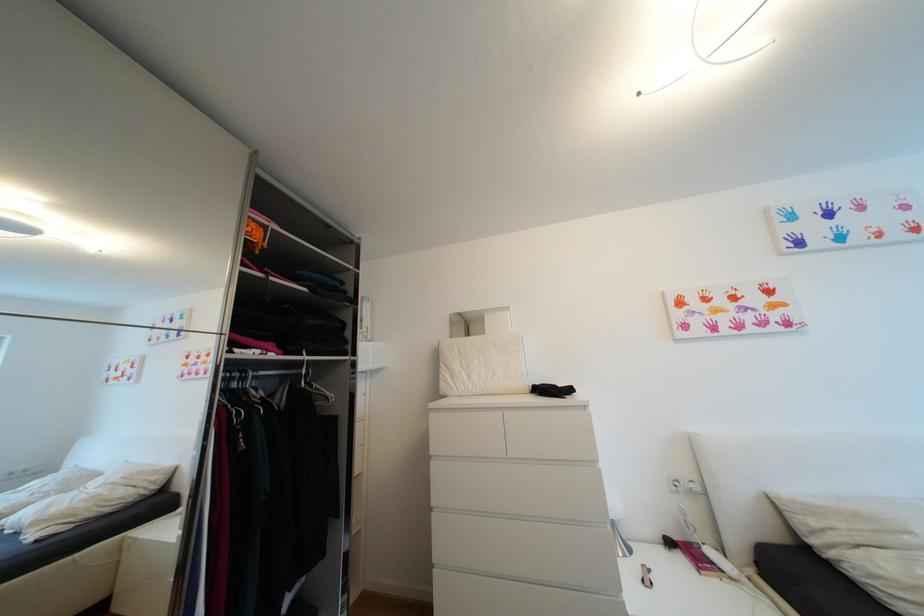
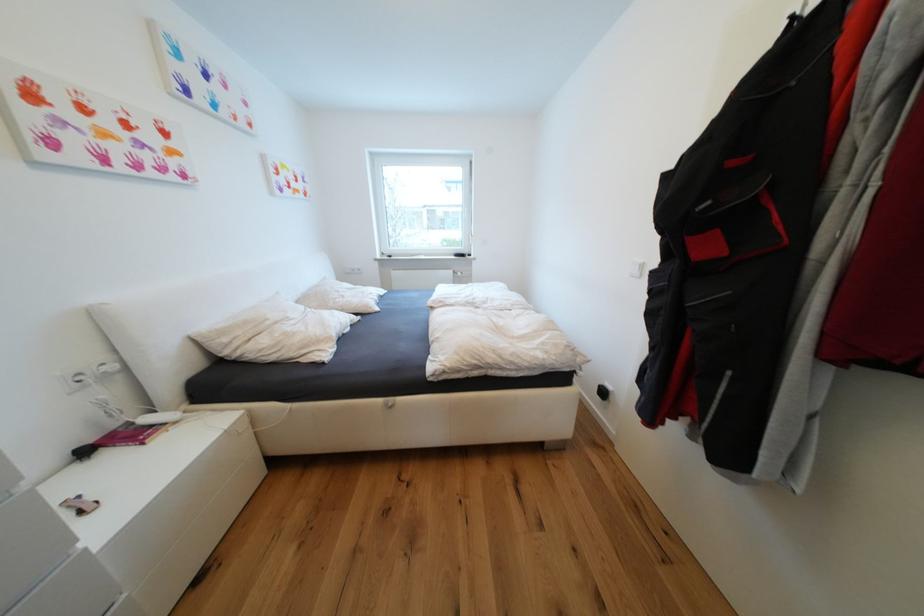
Question: Based on the continuous images, in which direction is the camera rotating? Reply with the corresponding letter.

Choices:
 (A) Left
 (B) Right
 (C) Up
 (D) Down

Answer: (B)